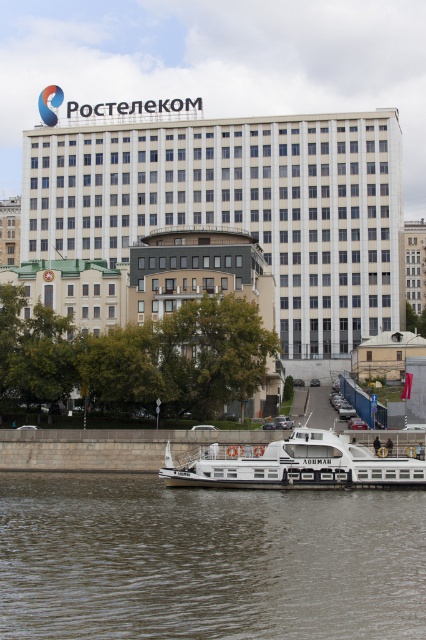
You are a photographer trying to capture both the white glossy boat at lower center and the white concrete building at center in a single frame. Considering their sizes, which object should you position closer to the camera to ensure both are visible in the frame?

Since the white glossy boat at lower center is smaller than the white concrete building at center, you should position the boat closer to the camera to balance their sizes in the frame.

You are standing at the waterfront and see the brown water at lower center and the white glass building at upper center. Which object is located to the right of the other?

The brown water at lower center is positioned on the right side of white glass building at upper center.

You are a tourist standing on the waterfront and want to take a photo of both the white glossy boat at lower center and the white concrete building at center. Which object should you focus on first if you want to capture both in the same frame without moving your camera?

You should focus on the white concrete building at center first because it is taller than the white glossy boat at lower center, allowing both to fit in the frame by adjusting the camera angle accordingly.